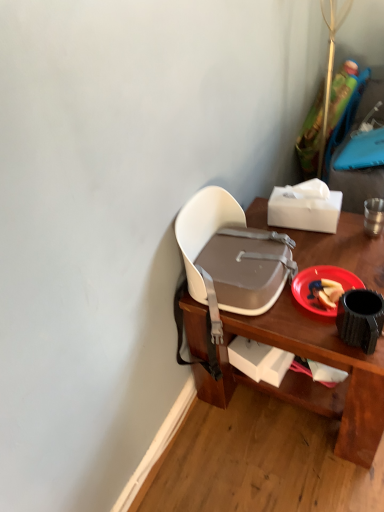
Question: Is the depth of white plastic chair at upper center greater than that of white matte tissue box at upper right, which is the 1th box from top to bottom?

Choices:
 (A) no
 (B) yes

Answer: (A)

Question: Is white plastic chair at upper center positioned with its back to white matte tissue box at upper right, which is the 1th box from top to bottom?

Choices:
 (A) yes
 (B) no

Answer: (B)

Question: Would you say white plastic chair at upper center is a long distance from white matte tissue box at upper right, which is the 1th box from top to bottom?

Choices:
 (A) no
 (B) yes

Answer: (A)

Question: Can you confirm if white plastic chair at upper center is positioned to the right of white matte tissue box at upper right, which is the 1th box from top to bottom?

Choices:
 (A) yes
 (B) no

Answer: (A)

Question: Does white plastic chair at upper center have a lesser width compared to white matte tissue box at upper right, the second box in the bottom-to-top sequence?

Choices:
 (A) no
 (B) yes

Answer: (A)

Question: Is white plastic chair at upper center in front of white matte tissue box at upper right, which is the 1th box from top to bottom?

Choices:
 (A) no
 (B) yes

Answer: (B)

Question: From a real-world perspective, is white matte box at lower center, which ranks as the 1th box in bottom-to-top order, positioned over white plastic chair at upper center based on gravity?

Choices:
 (A) yes
 (B) no

Answer: (B)

Question: From the image's perspective, is white matte box at lower center, which ranks as the second box in top-to-bottom order, below white plastic chair at upper center?

Choices:
 (A) yes
 (B) no

Answer: (A)

Question: Is white matte box at lower center, which ranks as the 1th box in bottom-to-top order, to the left of white plastic chair at upper center from the viewer's perspective?

Choices:
 (A) no
 (B) yes

Answer: (B)

Question: Does white matte box at lower center, which ranks as the second box in top-to-bottom order, have a greater height compared to white plastic chair at upper center?

Choices:
 (A) no
 (B) yes

Answer: (A)

Question: Is white matte box at lower center, which ranks as the 1th box in bottom-to-top order, turned away from white plastic chair at upper center?

Choices:
 (A) yes
 (B) no

Answer: (A)

Question: Considering the relative sizes of white matte box at lower center, which ranks as the 1th box in bottom-to-top order, and white plastic chair at upper center in the image provided, is white matte box at lower center, which ranks as the 1th box in bottom-to-top order, shorter than white plastic chair at upper center?

Choices:
 (A) yes
 (B) no

Answer: (A)

Question: Is white matte box at lower center, which ranks as the 1th box in bottom-to-top order, far from red plastic plate at lower right?

Choices:
 (A) no
 (B) yes

Answer: (A)